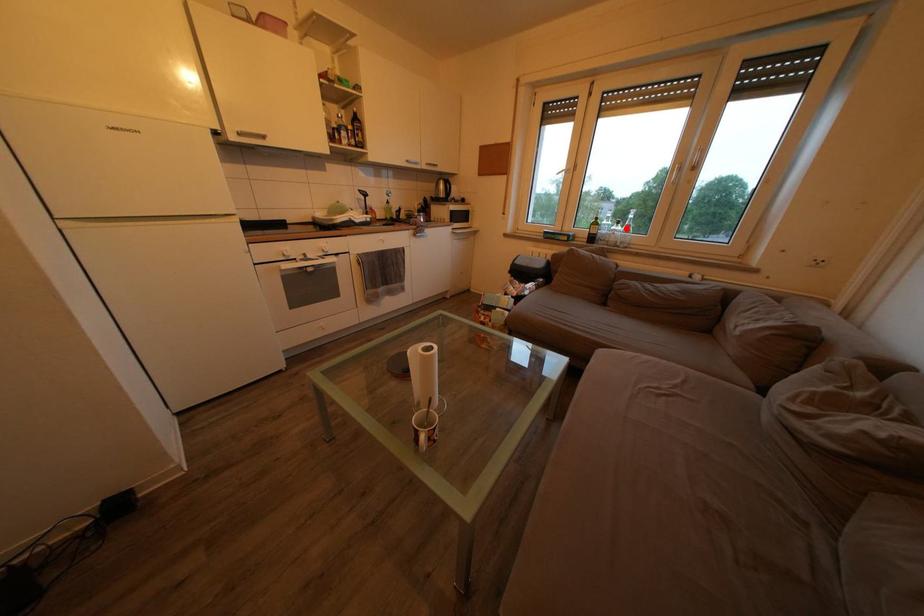
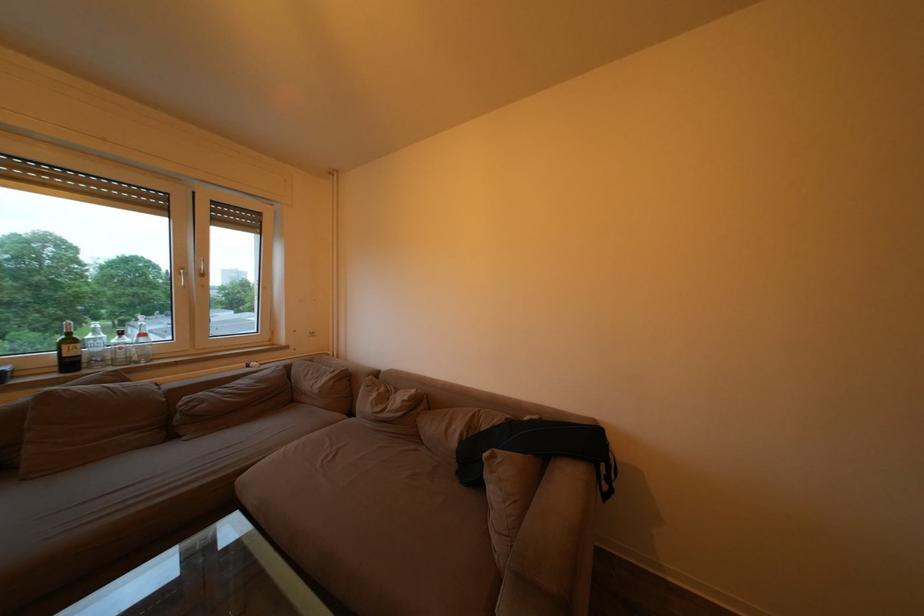
Question: I am providing you with two images of the same scene from different viewpoints. A red point is marked on the first image. At the location where the point appears in image 1, is it still visible in image 2?

Choices:
 (A) Yes
 (B) No

Answer: (A)